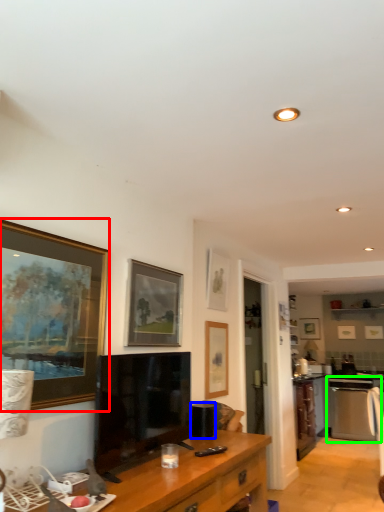
Question: Estimate the real-world distances between objects in this image. Which object is farther from picture frame (highlighted by a red box), appliance (highlighted by a blue box) or oven (highlighted by a green box)?

Choices:
 (A) appliance
 (B) oven

Answer: (B)